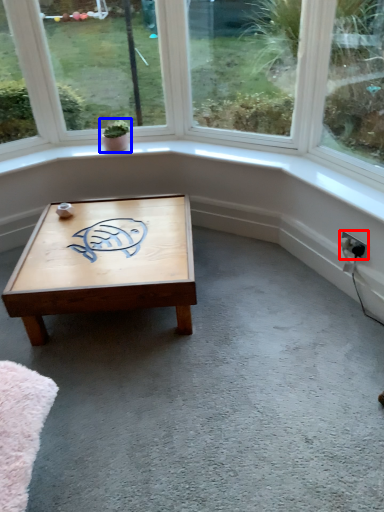
Question: Which object is further to the camera taking this photo, electric outlet (highlighted by a red box) or houseplant (highlighted by a blue box)?

Choices:
 (A) electric outlet
 (B) houseplant

Answer: (B)